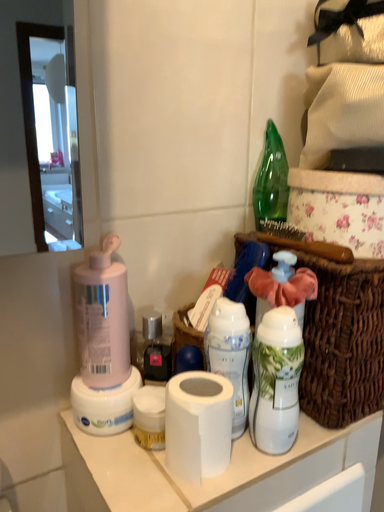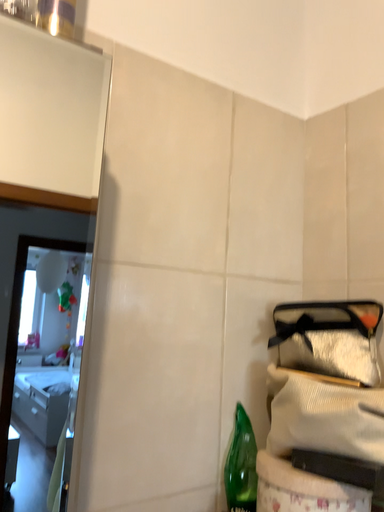
Question: Which way did the camera rotate in the video?

Choices:
 (A) rotated downward
 (B) rotated upward

Answer: (B)